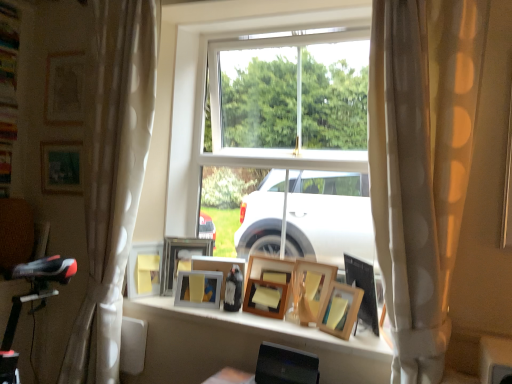
Question: Is wooden picture frame at center, the fifth picture frame viewed from the left, in front of or behind wooden picture frame at center, which is the tenth picture frame from left to right, in the image?

Choices:
 (A) front
 (B) behind

Answer: (B)

Question: Based on their positions, is wooden picture frame at center, the fifth picture frame viewed from the left, located to the left or right of wooden picture frame at center, which is the tenth picture frame from left to right?

Choices:
 (A) left
 (B) right

Answer: (A)

Question: Estimate the real-world distances between objects in this image. Which object is closer to the matte wooden picture frame at upper left, the 1th picture frame positioned from the left?

Choices:
 (A) wooden picture frame at center, arranged as the seventh picture frame when viewed from the right
 (B) wooden picture frame at upper left, the 9th picture frame when ordered from right to left
 (C) wooden picture frame at center, which is counted as the first picture frame, starting from the right
 (D) wooden picture frame at center, positioned as the 6th picture frame in left-to-right order
 (E) white dotted curtain at left, the first curtain from the back

Answer: (B)

Question: Which object is the closest to the wooden picture frame at center, which is the third picture frame from right to left?

Choices:
 (A) wooden picture frame at center, acting as the ninth picture frame starting from the left
 (B) wooden picture frame at center, which is counted as the first picture frame, starting from the right
 (C) wooden picture frame at center, the 6th picture frame positioned from the right
 (D) wooden picture frame at upper left, the second picture frame from the left
 (E) matte wooden picture frame at upper left, the 1th picture frame positioned from the left

Answer: (A)